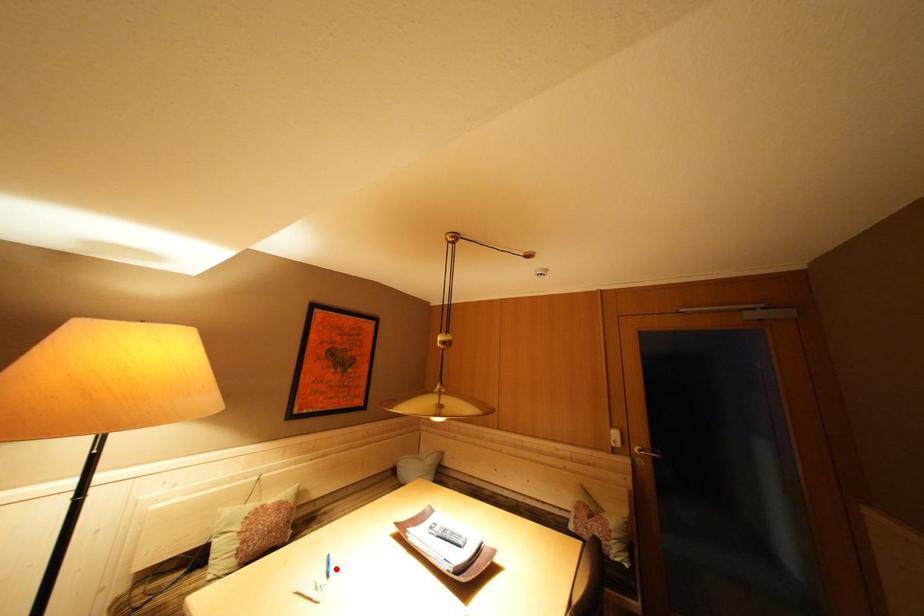
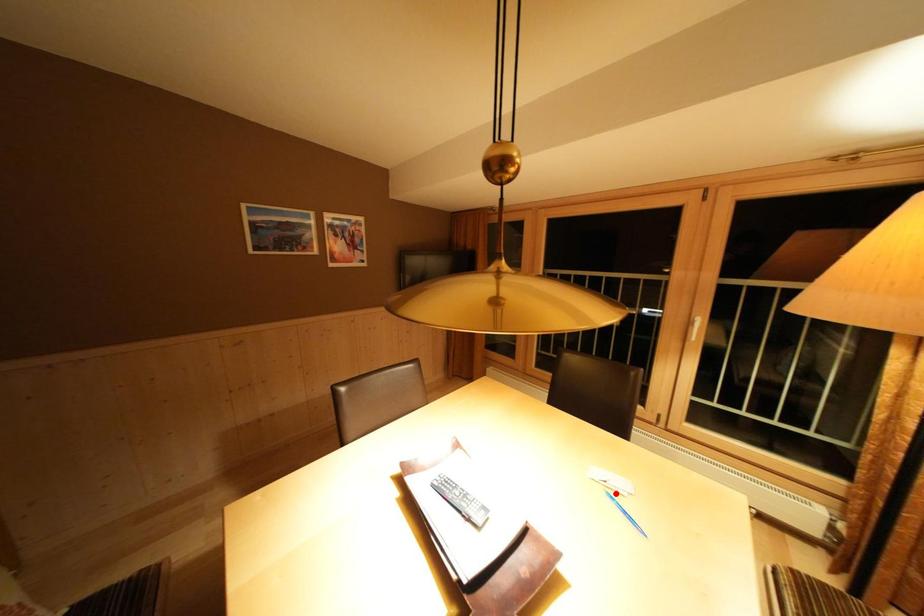
Looking at this image, I am providing you with two images of the same scene from different viewpoints. A red point is marked on the first image and another point is marked on the second image. Is the marked point in image1 the same physical position as the marked point in image2?

No